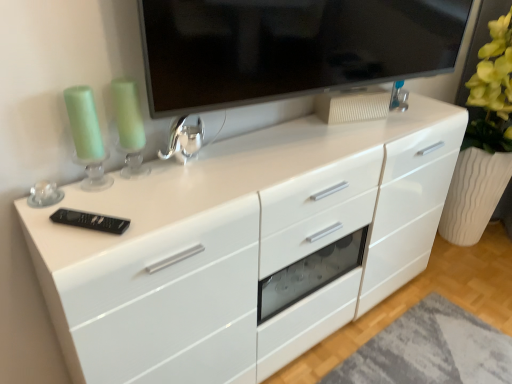
Question: Is black plastic remote at lower left, positioned as the second appliance in back-to-front order, further to camera compared to shiny metallic faucet at center, which is the 1th appliance in back-to-front order?

Choices:
 (A) yes
 (B) no

Answer: (B)

Question: Does black plastic remote at lower left, which appears as the 1th appliance when viewed from the left, have a lesser width compared to shiny metallic faucet at center, the 1th appliance in the top-to-bottom sequence?

Choices:
 (A) no
 (B) yes

Answer: (A)

Question: Is shiny metallic faucet at center, arranged as the 1th appliance when viewed from the right, located within black plastic remote at lower left, positioned as the second appliance in back-to-front order?

Choices:
 (A) yes
 (B) no

Answer: (B)

Question: Is black plastic remote at lower left, the 1th appliance in the front-to-back sequence, positioned before shiny metallic faucet at center, which is the 2th appliance from front to back?

Choices:
 (A) no
 (B) yes

Answer: (B)

Question: Is black plastic remote at lower left, acting as the 2th appliance starting from the top, at the right side of shiny metallic faucet at center, the 1th appliance in the top-to-bottom sequence?

Choices:
 (A) no
 (B) yes

Answer: (A)

Question: Is black plastic remote at lower left, positioned as the second appliance in back-to-front order, in front of or behind white glossy chest of drawers at center in the image?

Choices:
 (A) front
 (B) behind

Answer: (B)

Question: Do you think black plastic remote at lower left, acting as the 2th appliance starting from the top, is within white glossy chest of drawers at center, or outside of it?

Choices:
 (A) inside
 (B) outside

Answer: (A)

Question: In terms of height, does black plastic remote at lower left, the 1th appliance ordered from the bottom, look taller or shorter compared to white glossy chest of drawers at center?

Choices:
 (A) tall
 (B) short

Answer: (B)

Question: Is point (84, 226) closer or farther from the camera than point (131, 251)?

Choices:
 (A) closer
 (B) farther

Answer: (B)

Question: Is shiny metallic faucet at center, the second appliance positioned from the bottom, in front of or behind matte black tv at upper center in the image?

Choices:
 (A) behind
 (B) front

Answer: (A)

Question: Considering the positions of shiny metallic faucet at center, arranged as the 1th appliance when viewed from the right, and matte black tv at upper center in the image, is shiny metallic faucet at center, arranged as the 1th appliance when viewed from the right, wider or thinner than matte black tv at upper center?

Choices:
 (A) wide
 (B) thin

Answer: (B)

Question: Choose the correct answer: Is shiny metallic faucet at center, arranged as the 1th appliance when viewed from the right, inside matte black tv at upper center or outside it?

Choices:
 (A) outside
 (B) inside

Answer: (A)

Question: From a real-world perspective, relative to matte black tv at upper center, is shiny metallic faucet at center, which appears as the 2th appliance when viewed from the left, vertically above or below?

Choices:
 (A) above
 (B) below

Answer: (B)

Question: Is shiny metallic faucet at center, the 1th appliance in the top-to-bottom sequence, to the left or to the right of black plastic remote at lower left, acting as the 2th appliance starting from the top, in the image?

Choices:
 (A) right
 (B) left

Answer: (A)

Question: Is point (160, 158) closer or farther from the camera than point (60, 221)?

Choices:
 (A) closer
 (B) farther

Answer: (B)